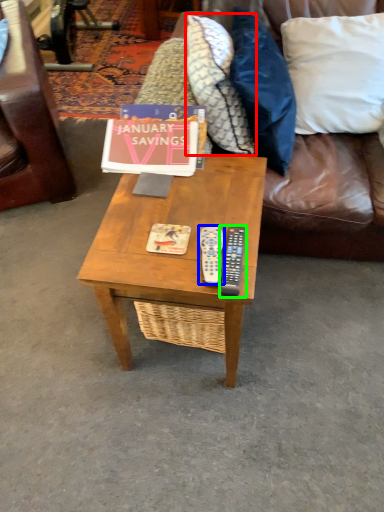
Question: Which object is the farthest from pillow (highlighted by a red box)? Choose among these: remote (highlighted by a blue box) or remote (highlighted by a green box).

Choices:
 (A) remote
 (B) remote

Answer: (A)